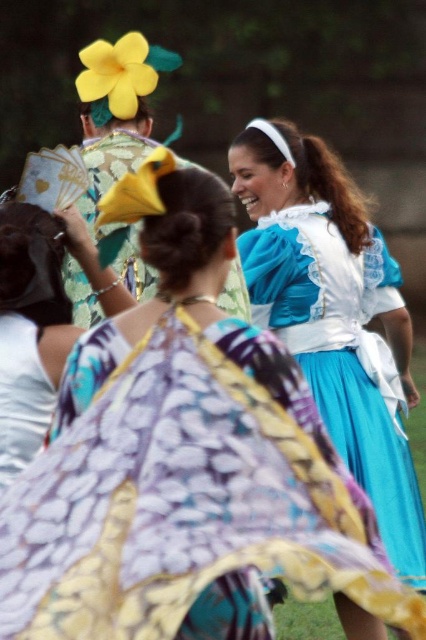
Question: Can you confirm if yellow fabric flower at upper center is positioned to the left of yellow paper fan at upper left?

Choices:
 (A) no
 (B) yes

Answer: (B)

Question: Among these points, which one is farthest from the camera?

Choices:
 (A) (101, 205)
 (B) (276, 308)

Answer: (B)

Question: Is blue satin dress at center to the right of matte yellow fabric at center from the viewer's perspective?

Choices:
 (A) no
 (B) yes

Answer: (B)

Question: Which point is closer to the camera?

Choices:
 (A) [x=2, y=216]
 (B) [x=325, y=387]
 (C) [x=115, y=115]

Answer: (A)

Question: Among these objects, which one is farthest from the camera?

Choices:
 (A) blue satin dress at center
 (B) matte yellow fabric at center
 (C) yellow paper fan at upper left
 (D) yellow fabric flower at upper center

Answer: (D)

Question: Can you confirm if blue satin dress at center is smaller than yellow fabric flower at upper center?

Choices:
 (A) no
 (B) yes

Answer: (A)